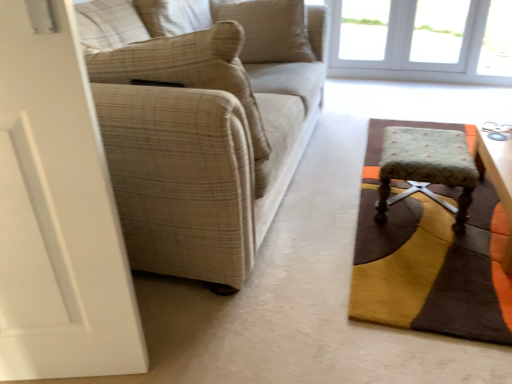
Where is `free space to the left of floral fabric stool at lower right`? free space to the left of floral fabric stool at lower right is located at coordinates (336, 205).